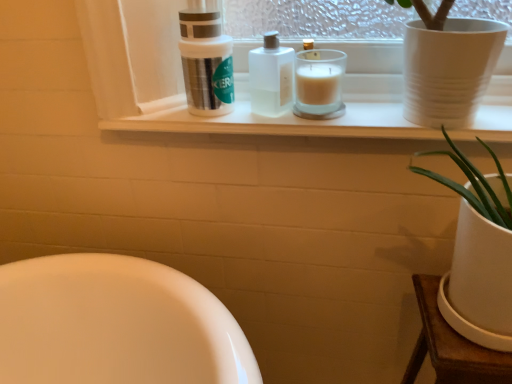
Identify the location of free space in front of translucent glass candle at center. The image size is (512, 384). (329, 127).